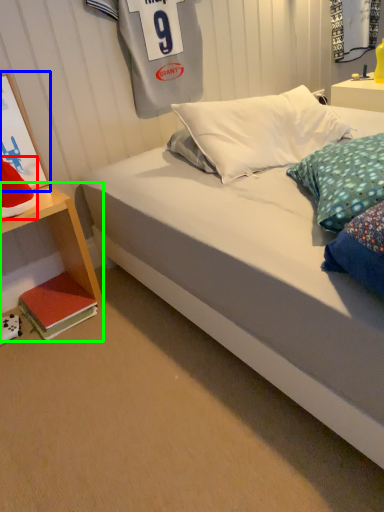
Question: Which is farther away from pillow (highlighted by a red box)? picture frame (highlighted by a blue box) or nightstand (highlighted by a green box)?

Choices:
 (A) picture frame
 (B) nightstand

Answer: (B)